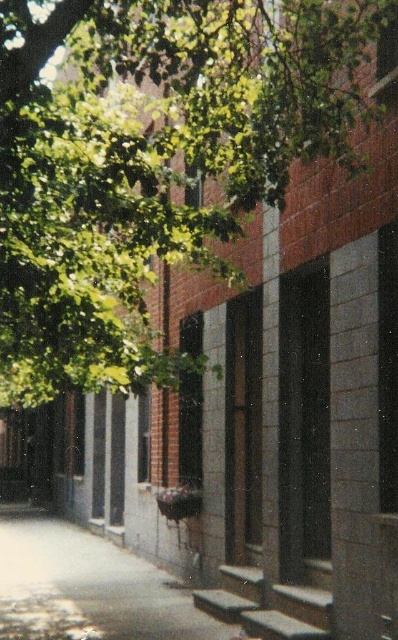
From the picture: You are standing at the point (122, 68) on the map. You need to walk to the entrance of the building that is closest to you. How far will you have to walk?

The entrance of the building is 5.24 meters away from the point (122, 68), so you will have to walk 5.24 meters.

You are a delivery person trying to park your bike. The bike requires 10 feet of space. You see the green leafy tree at upper left and the gray concrete pavement at lower center. Is there enough space between them to park your bike?

The green leafy tree at upper left and gray concrete pavement at lower center are 18.65 feet apart from each other. Since the bike requires 10 feet of space, there is enough space between them to park the bike.